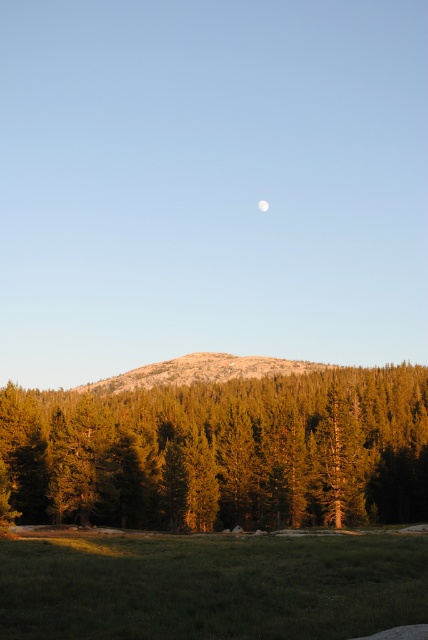
Does point (359, 476) come in front of point (264, 204)?

Yes, it is in front of point (264, 204).

Is point (41, 499) positioned before point (259, 209)?

Yes, point (41, 499) is in front of point (259, 209).

Locate an element on the screen. This screenshot has height=640, width=428. green textured tree at center is located at coordinates tap(222, 451).

Which of these two, granite rock at center or white matte moon at upper center, stands shorter?

With less height is white matte moon at upper center.

Does granite rock at center have a smaller size compared to white matte moon at upper center?

Actually, granite rock at center might be larger than white matte moon at upper center.

Identify the location of granite rock at center. This screenshot has width=428, height=640. pos(201,371).

Locate an element on the screen. Image resolution: width=428 pixels, height=640 pixels. granite rock at center is located at coordinates (x=201, y=371).

Identify the location of green textured tree at center. (222, 451).

At what (x,y) coordinates should I click in order to perform the action: click on green textured tree at center. Please return your answer as a coordinate pair (x, y). Looking at the image, I should click on (222, 451).